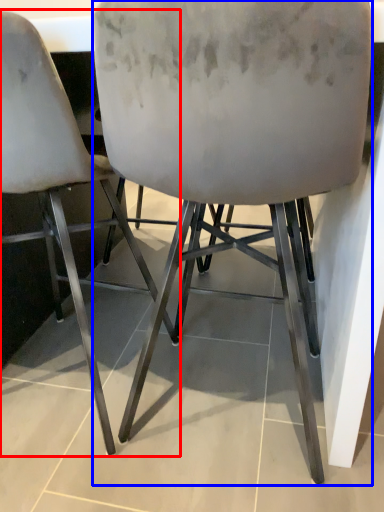
Question: Which of the following is the farthest to the observer, chair (highlighted by a red box) or chair (highlighted by a blue box)?

Choices:
 (A) chair
 (B) chair

Answer: (A)